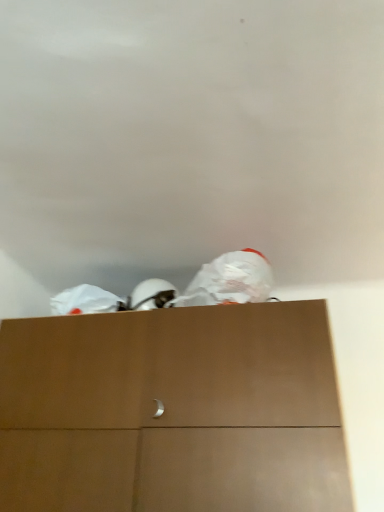
Question: Should I look upward or downward to see white matte plastic bag at upper center?

Choices:
 (A) down
 (B) up

Answer: (A)